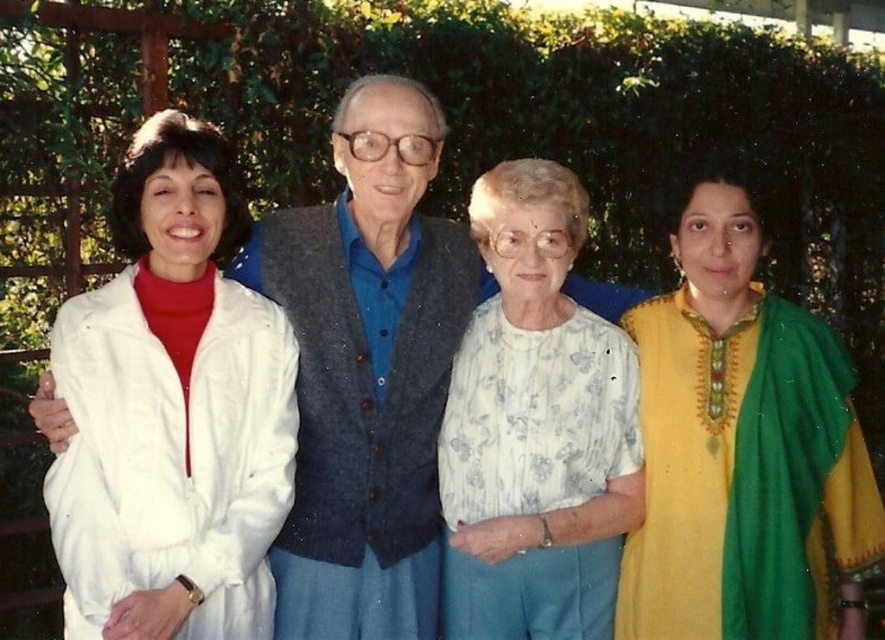
From the picture: How distant is white textured blouse at center from white floral blouse at center?

A distance of 69.45 centimeters exists between white textured blouse at center and white floral blouse at center.

Does white textured blouse at center appear under white floral blouse at center?

Actually, white textured blouse at center is above white floral blouse at center.

Does point (186, 316) lie in front of point (497, 566)?

Yes.

The image size is (885, 640). In order to click on white textured blouse at center in this screenshot , I will do `click(177, 406)`.

Between floral cotton blouse at center and white floral blouse at center, which one appears on the right side from the viewer's perspective?

From the viewer's perspective, floral cotton blouse at center appears more on the right side.

Who is taller, floral cotton blouse at center or white floral blouse at center?

Standing taller between the two is white floral blouse at center.

Which is behind, point (833, 476) or point (464, 493)?

The point (464, 493) is behind.

In order to click on floral cotton blouse at center in this screenshot , I will do `click(743, 449)`.

Between white textured blouse at center and floral cotton blouse at center, which one is positioned higher?

white textured blouse at center is above.

Does point (199, 595) come closer to viewer compared to point (789, 522)?

Yes.

The height and width of the screenshot is (640, 885). I want to click on white textured blouse at center, so click(x=177, y=406).